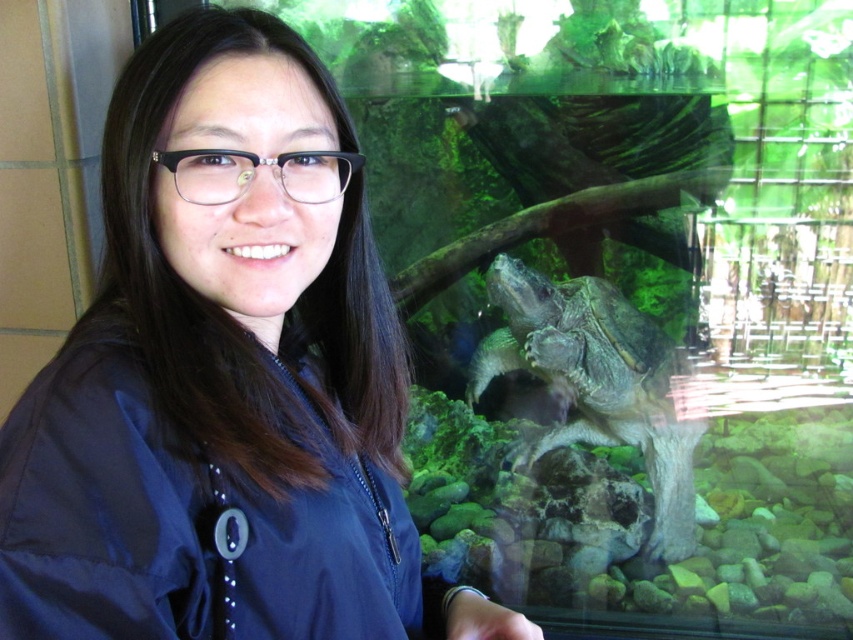
You are a visitor at the aquarium and want to take a photo of the blue fabric at center. Where should you position yourself to capture it in the frame?

The blue fabric at center is located at point 0.592 on the x axis and 0.265 on the y axis, so you should position yourself directly in front of that coordinate to capture it in the frame.

You are a visitor at the aquarium and want to take a photo of the blue fabric at center and the smooth gray tortoise at center in the same frame. Your camera has a maximum focus range of 36 inches. Can you capture both objects in focus without moving your position?

The distance between the blue fabric at center and the smooth gray tortoise at center is 39.32 inches, which exceeds the camera maximum focus range of 36 inches. You cannot capture both in focus without moving.